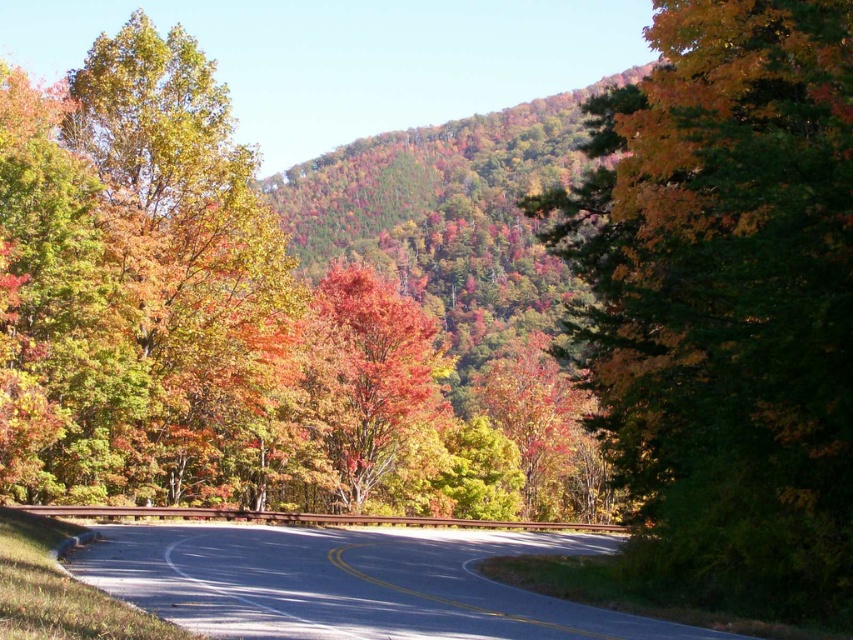
Question: Which point is closer to the camera?

Choices:
 (A) (616, 275)
 (B) (370, 394)
 (C) (444, 618)

Answer: (C)

Question: Does green matte tree at right have a larger size compared to asphalt road at center?

Choices:
 (A) no
 (B) yes

Answer: (A)

Question: Is green matte tree at right thinner than asphalt road at center?

Choices:
 (A) yes
 (B) no

Answer: (A)

Question: Which object is positioned farthest from the shiny red maple tree at center?

Choices:
 (A) green matte tree at right
 (B) asphalt road at center

Answer: (A)

Question: In this image, where is green matte tree at right located relative to asphalt road at center?

Choices:
 (A) below
 (B) above

Answer: (B)

Question: Estimate the real-world distances between objects in this image. Which object is farther from the green matte tree at right?

Choices:
 (A) asphalt road at center
 (B) shiny red maple tree at center

Answer: (B)